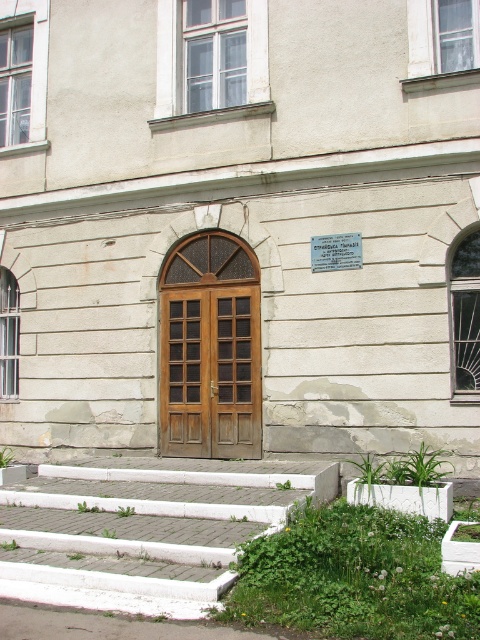
Between white concrete stairs at lower center and wooden door at center, which one is positioned lower?

white concrete stairs at lower center is lower down.

How much distance is there between white concrete stairs at lower center and wooden door at center?

white concrete stairs at lower center is 2.35 meters away from wooden door at center.

Describe the element at coordinates (144, 529) in the screenshot. Image resolution: width=480 pixels, height=640 pixels. I see `white concrete stairs at lower center` at that location.

This screenshot has height=640, width=480. I want to click on white concrete stairs at lower center, so click(144, 529).